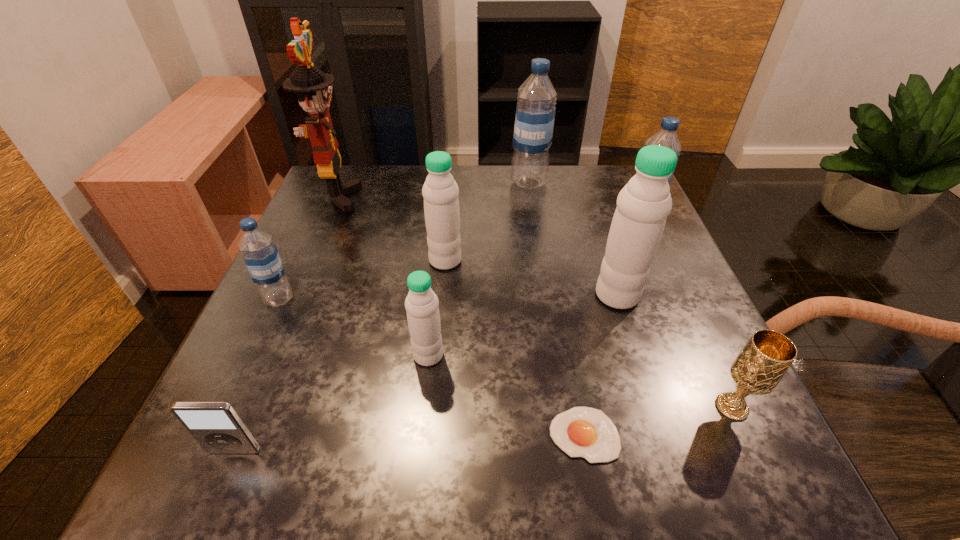
Identify the location of vacant space at the far edge of the desktop. This screenshot has height=540, width=960. (497, 206).

In the image, there is a desktop. Where is `vacant space at the near edge`? This screenshot has height=540, width=960. vacant space at the near edge is located at coordinates (424, 464).

At what (x,y) coordinates should I click in order to perform the action: click on vacant space at the left edge. Please return your answer as a coordinate pair (x, y). The image size is (960, 540). Looking at the image, I should click on [x=333, y=267].

Locate an element on the screen. The width and height of the screenshot is (960, 540). vacant region at the far left corner of the desktop is located at coordinates (329, 211).

Where is `free location at the far right corner`? This screenshot has height=540, width=960. free location at the far right corner is located at coordinates (575, 176).

The width and height of the screenshot is (960, 540). Find the location of `blank region between the iPod and the egg yolk`. blank region between the iPod and the egg yolk is located at coordinates (409, 443).

Where is `free space that is in between the ninth tallest object and the nearest blue water bottle`? The height and width of the screenshot is (540, 960). free space that is in between the ninth tallest object and the nearest blue water bottle is located at coordinates (256, 375).

The width and height of the screenshot is (960, 540). What are the coordinates of `unoccupied area between the eighth object from left to right and the farthest blue water bottle` in the screenshot? It's located at (573, 239).

Where is `free space that is in between the rightmost white water bottle and the nutcracker`? Image resolution: width=960 pixels, height=540 pixels. free space that is in between the rightmost white water bottle and the nutcracker is located at coordinates (477, 246).

Locate an element on the screen. Image resolution: width=960 pixels, height=540 pixels. free space that is in between the shortest object and the nearest white water bottle is located at coordinates (506, 395).